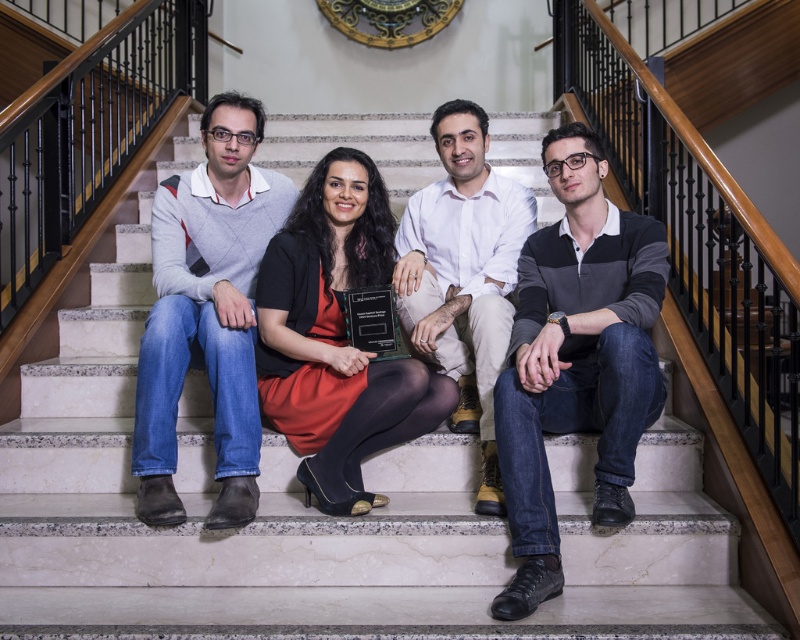
You are a photographer standing at the bottom of the stairs. You need to take a photo of the matte gray sweater at left and the white cotton shirt at center so that both are in focus. The camera you have can only focus on objects within a 30 inch range. Will you be able to capture both subjects clearly in the same photo?

The matte gray sweater at left and white cotton shirt at center are 31.40 inches apart from each other. Since the camera can only focus within a 30 inch range, the distance between them exceeds the focus range. Therefore, both subjects cannot be in focus simultaneously in the same photo.

You are standing at the bottom of the marble stairs and want to hand a document to the person wearing the dark gray knit sweater at center. If you walk straight up the stairs, will you have to pass by the other people sitting on the stairs?

Yes, since the dark gray knit sweater at center is 7.35 feet away from the others, you will need to pass by them to reach the sweater wearer.

You are a photographer trying to capture a group photo of the matte gray sweater at left and the white cotton shirt at center. Since you want to ensure both are in focus, you need to know which one is taller. Can you determine which one is taller?

The matte gray sweater at left has a greater height compared to the white cotton shirt at center, so the matte gray sweater at left is taller.